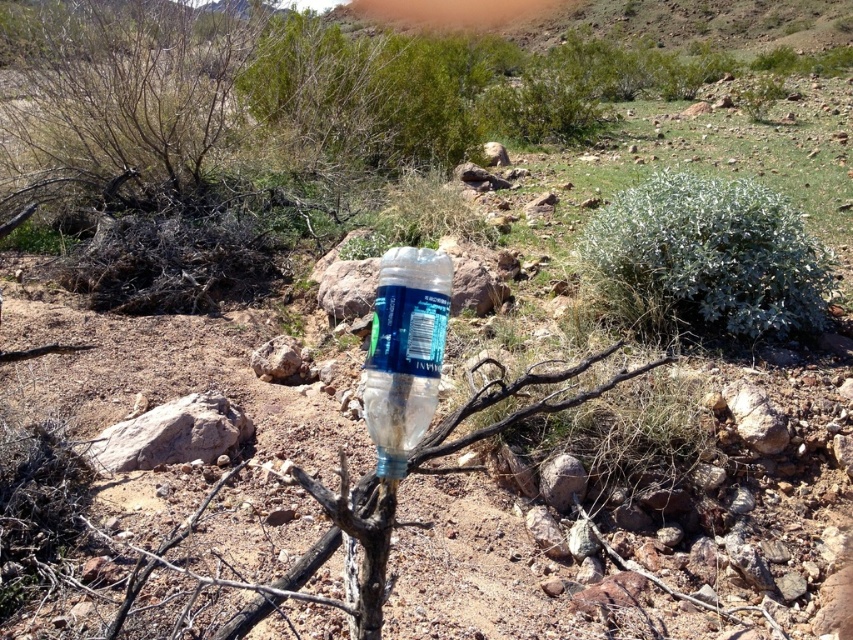
From the picture: You are a hiker who has just arrived at this desert area. You see a transparent plastic bottle at center. Can you estimate its exact location in terms of coordinates?

The transparent plastic bottle at center is located at point (405,353).

You are a hiker who needs to determine which object is narrower between the transparent plastic bottle at center and the clear plastic branch at center. Based on the scene, which one is narrower?

The transparent plastic bottle at center is narrower than the clear plastic branch at center.

You are a hiker who has just arrived in this desert area. You see a green fuzzy bush at center right and a transparent plastic bottle at center. Which object is taller?

The green fuzzy bush at center right has a greater height compared to the transparent plastic bottle at center, so the green fuzzy bush at center right is taller.